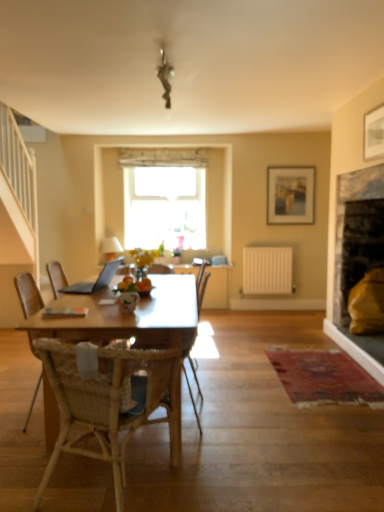
What are the coordinates of `free location to the right of woven wood chair at center, which is the 1th chair from front to back` in the screenshot? It's located at (236, 471).